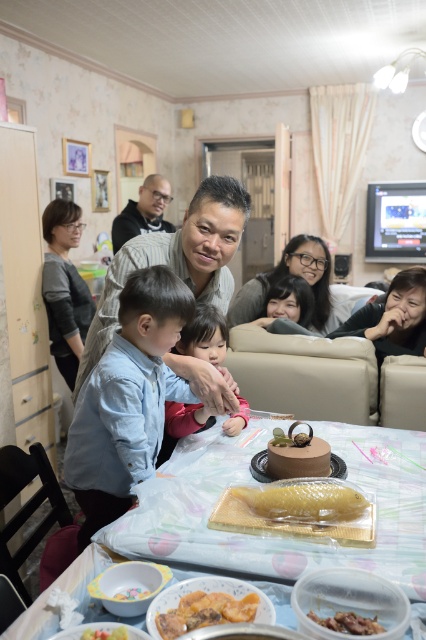
Question: Among these points, which one is nearest to the camera?

Choices:
 (A) (288, 451)
 (B) (117, 593)

Answer: (B)

Question: Among these points, which one is nearest to the camera?

Choices:
 (A) (157, 586)
 (B) (198, 349)

Answer: (A)

Question: Is brown matte cake at center thinner than white glossy bowl at lower left?

Choices:
 (A) yes
 (B) no

Answer: (B)

Question: Which object is positioned farthest from the blue denim shirt at center?

Choices:
 (A) white glossy bowl at lower left
 (B) golden glazed fish at center

Answer: (A)

Question: Can you confirm if blue denim shirt at center is bigger than golden glazed fish at center?

Choices:
 (A) yes
 (B) no

Answer: (A)

Question: Is blue denim shirt at center to the left of light pink fabric at center from the viewer's perspective?

Choices:
 (A) no
 (B) yes

Answer: (B)